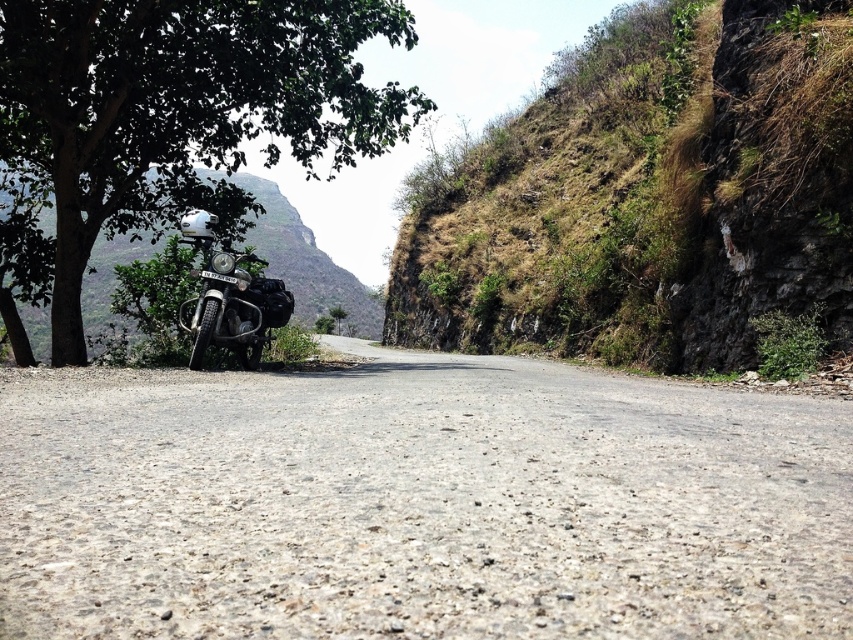
Can you confirm if green leafy tree at left is bigger than green grassy mountain at left?

Indeed, green leafy tree at left has a larger size compared to green grassy mountain at left.

Can you confirm if green leafy tree at left is wider than green grassy mountain at left?

Yes.

Locate an element on the screen. This screenshot has height=640, width=853. green leafy tree at left is located at coordinates pos(181,109).

The image size is (853, 640). I want to click on green leafy tree at left, so click(181, 109).

You are a GUI agent. You are given a task and a screenshot of the screen. Output one action in this format:
    pyautogui.click(x=<x>, y=<y>)
    Task: Click on the gray asphalt road at center
    This screenshot has height=640, width=853.
    Given the screenshot: What is the action you would take?
    pos(419,502)

Between gray asphalt road at center and dull brown rock at upper right, which one has more height?

dull brown rock at upper right is taller.

Find the location of `gray asphalt road at center`. gray asphalt road at center is located at coordinates (419, 502).

Is gray asphalt road at center wider than green leafy tree at left?

Incorrect, gray asphalt road at center's width does not surpass green leafy tree at left's.

Which is in front, point (363, 548) or point (38, 80)?

Point (363, 548) is more forward.

The image size is (853, 640). In order to click on gray asphalt road at center in this screenshot , I will do `click(419, 502)`.